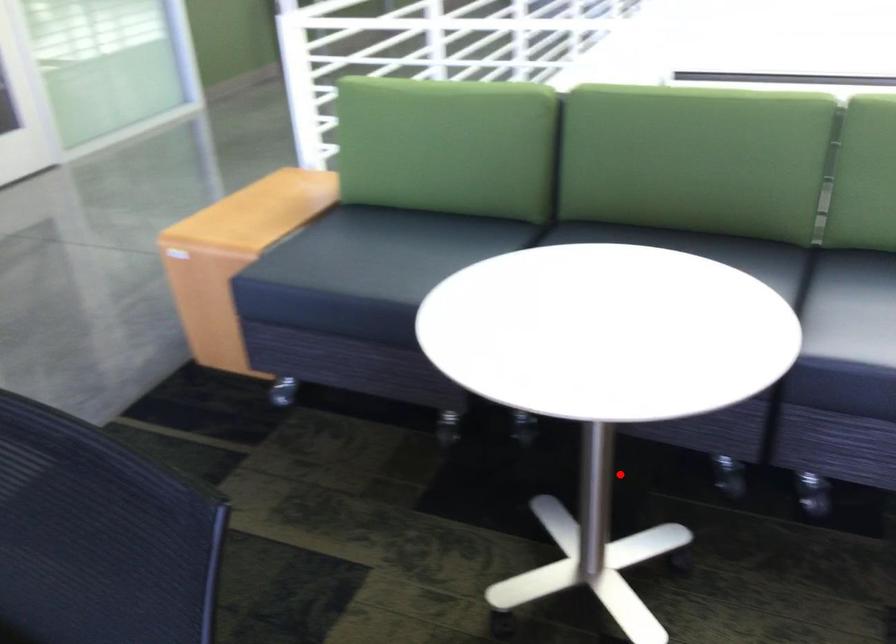
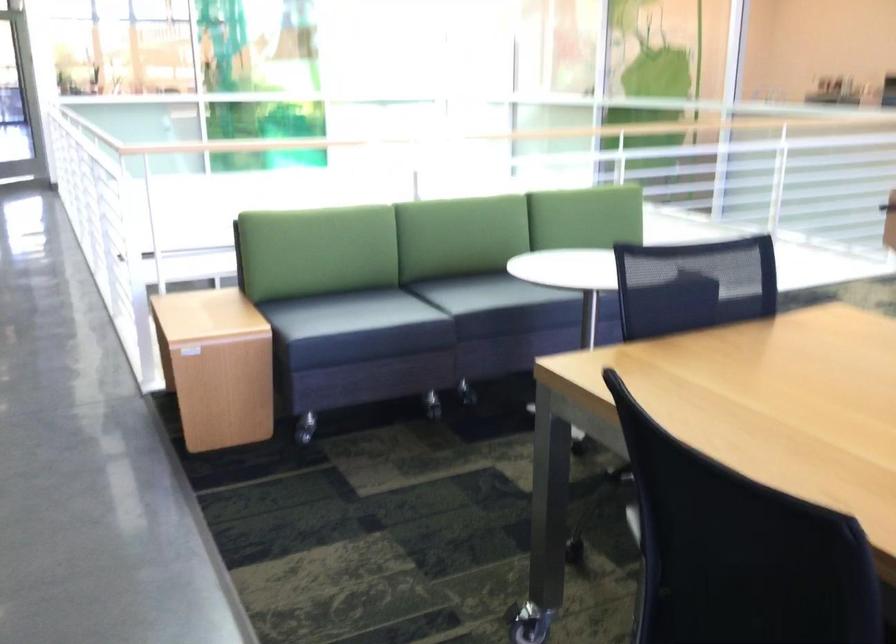
In the second image, find the point that corresponds to the highlighted location in the first image.

(467, 393)